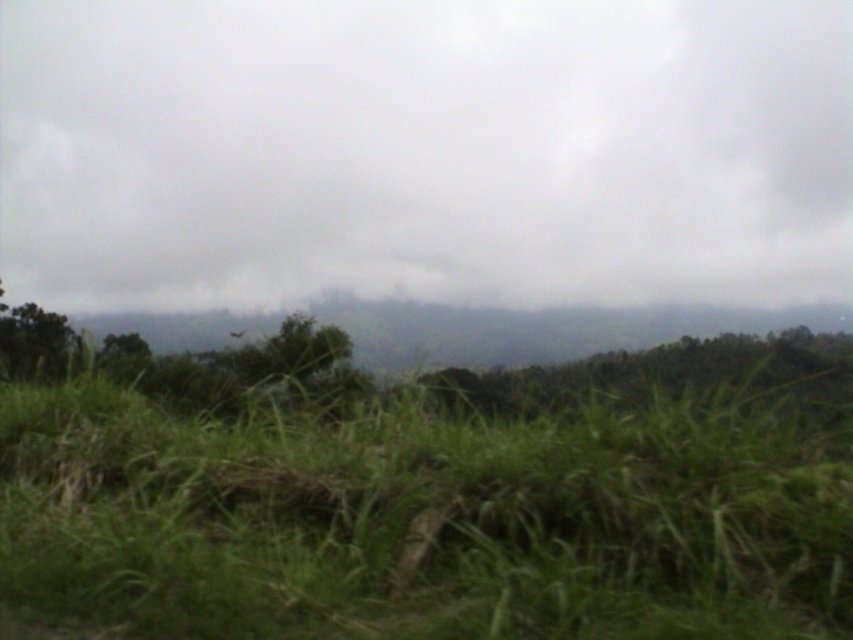
Describe the element at coordinates (422, 518) in the screenshot. The image size is (853, 640). I see `green grassy field at lower center` at that location.

The width and height of the screenshot is (853, 640). I want to click on green grassy field at lower center, so tap(422, 518).

Which is in front, point (428, 33) or point (316, 420)?

Point (316, 420) is in front.

Can you confirm if gray cloudy sky at upper center is positioned to the right of green grassy field at lower center?

Incorrect, gray cloudy sky at upper center is not on the right side of green grassy field at lower center.

Is point (527, 173) in front of point (271, 468)?

No, it is not.

Locate an element on the screen. gray cloudy sky at upper center is located at coordinates (425, 150).

Can you confirm if gray cloudy sky at upper center is positioned above green leafy tree at center?

Indeed, gray cloudy sky at upper center is positioned over green leafy tree at center.

Can you confirm if gray cloudy sky at upper center is positioned to the left of green leafy tree at center?

Yes, gray cloudy sky at upper center is to the left of green leafy tree at center.

Find the location of `gray cloudy sky at upper center`. gray cloudy sky at upper center is located at coordinates (425, 150).

At what (x,y) coordinates should I click in order to perform the action: click on gray cloudy sky at upper center. Please return your answer as a coordinate pair (x, y). Image resolution: width=853 pixels, height=640 pixels. Looking at the image, I should click on (425, 150).